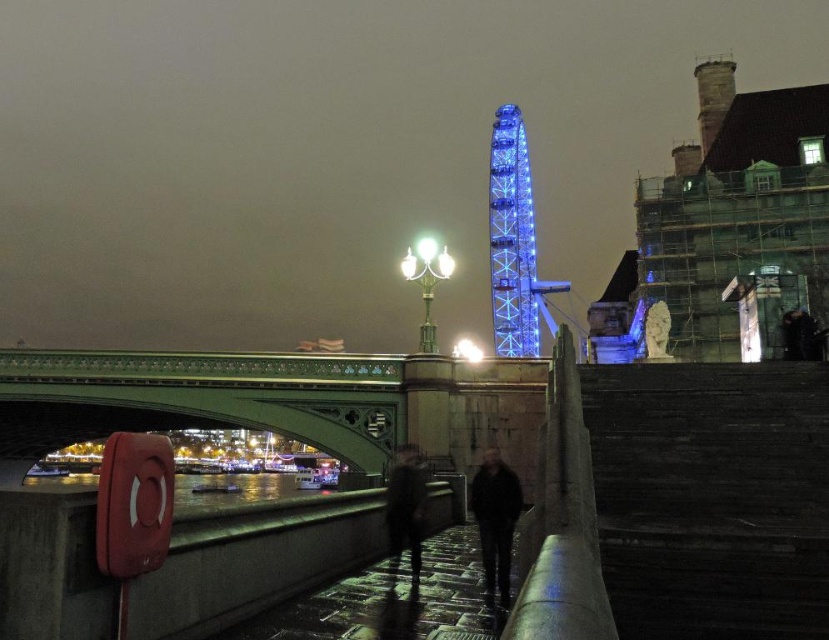
Question: Does green stone bridge at lower left appear over blue glass ferris wheel at upper center?

Choices:
 (A) no
 (B) yes

Answer: (A)

Question: Observing the image, what is the correct spatial positioning of green stone bridge at lower left in reference to black matte jacket at center?

Choices:
 (A) below
 (B) above

Answer: (B)

Question: Estimate the real-world distances between objects in this image. Which object is farther from the blue glass ferris wheel at upper center?

Choices:
 (A) black matte jacket at center
 (B) green stone bridge at lower left

Answer: (A)

Question: Which object is closer to the camera taking this photo?

Choices:
 (A) green stone bridge at lower left
 (B) dark fabric jacket at center

Answer: (B)

Question: Which of the following is the farthest from the observer?

Choices:
 (A) dark fabric jacket at center
 (B) green stone bridge at lower left
 (C) blue glass ferris wheel at upper center
 (D) black matte jacket at center

Answer: (C)

Question: Can you confirm if blue glass ferris wheel at upper center is positioned to the left of black matte jacket at center?

Choices:
 (A) yes
 (B) no

Answer: (B)